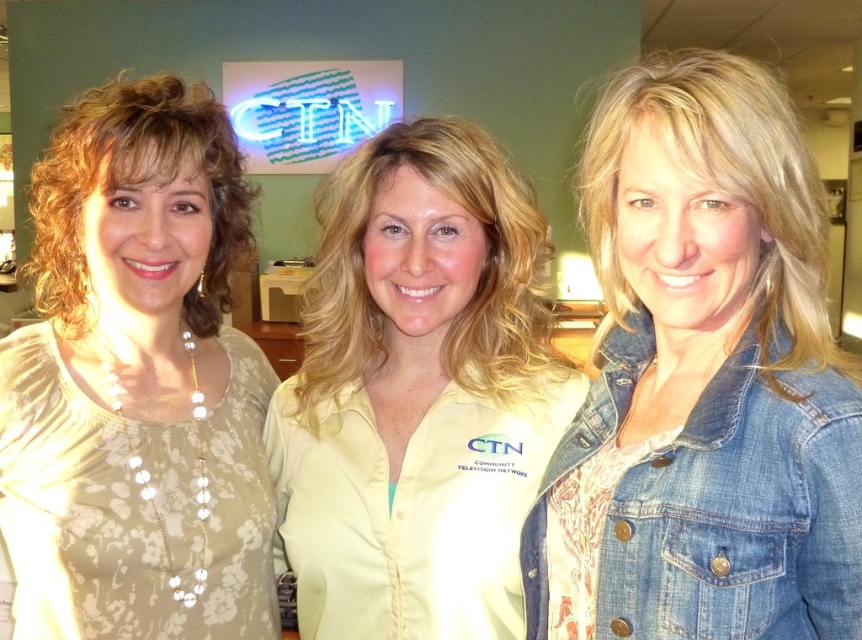
You are taking a photo of two points in the image. The first point is at coordinates point (x=436, y=145) and the second point is at point (x=704, y=403). Which point is closer to the camera?

Point (x=436, y=145) is further to the camera than point (x=704, y=403), so the first point is closer to the camera.